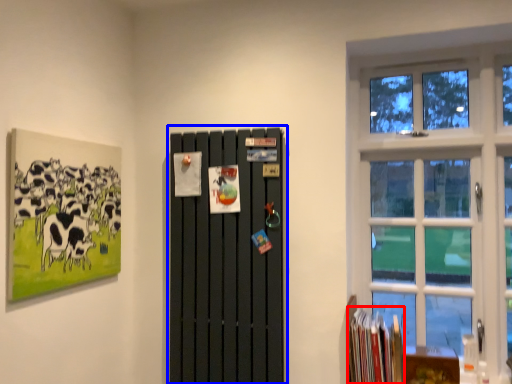
Question: Which point is further to the camera, book (highlighted by a red box) or barn door (highlighted by a blue box)?

Choices:
 (A) book
 (B) barn door

Answer: (A)